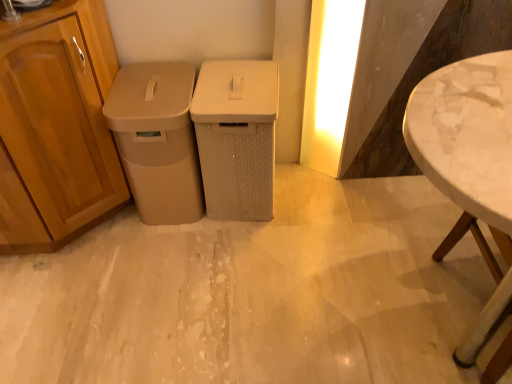
Find the location of `vacant area that is in front of beige textured waste bin at center, which appears as the second waste container when viewed from the left`. vacant area that is in front of beige textured waste bin at center, which appears as the second waste container when viewed from the left is located at coordinates (245, 250).